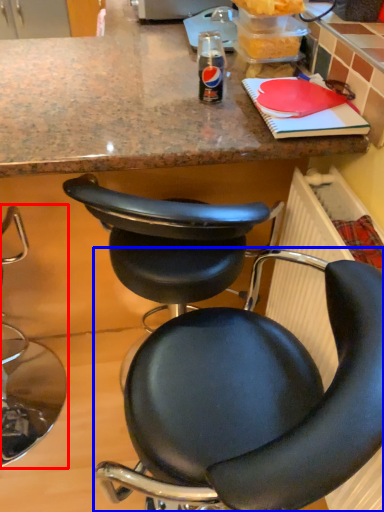
Question: Among these objects, which one is farthest to the camera, chair (highlighted by a red box) or chair (highlighted by a blue box)?

Choices:
 (A) chair
 (B) chair

Answer: (A)